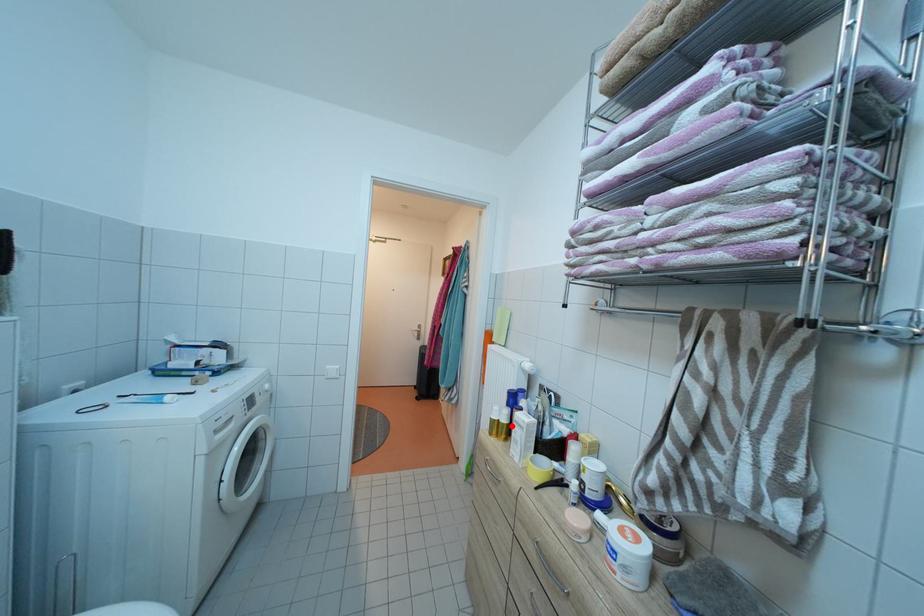
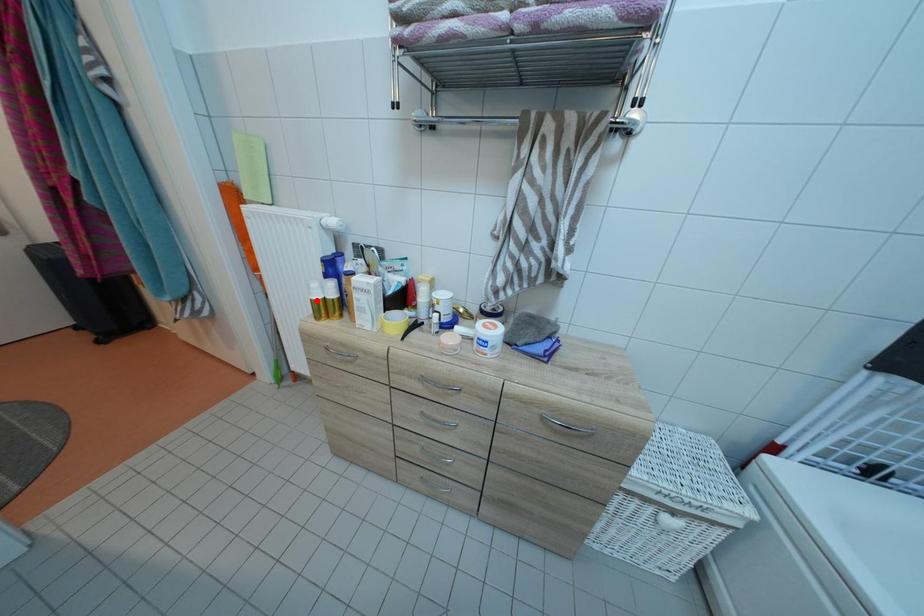
I am providing you with two images of the same scene from different viewpoints. A red point is marked on the first image and another point is marked on the second image. Is the marked point in image1 the same physical position as the marked point in image2?

No